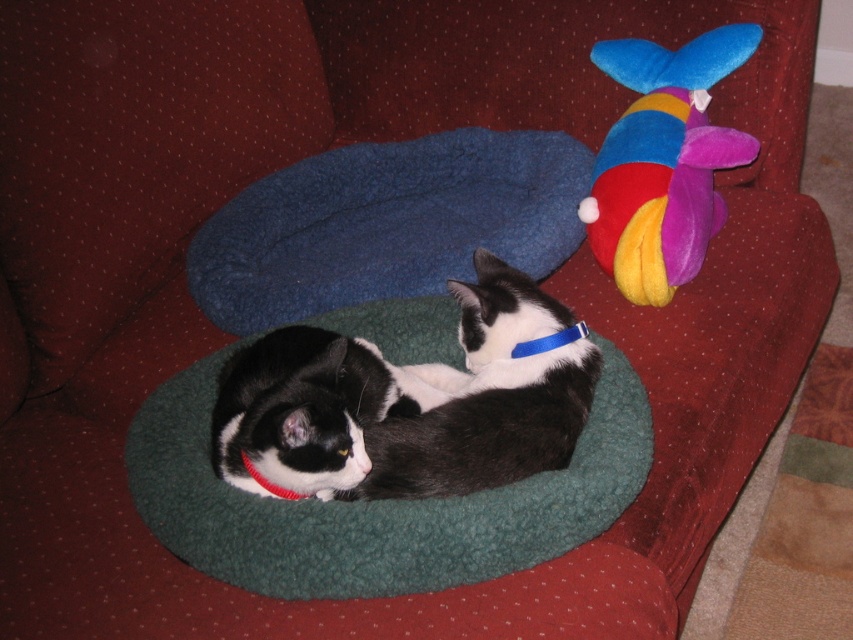
Who is more forward, (706,186) or (540,346)?

Point (540,346) is more forward.

Which is more to the left, velvet plush toy at upper right or blue fabric neckband at center?

blue fabric neckband at center is more to the left.

What do you see at coordinates (663, 161) in the screenshot? This screenshot has width=853, height=640. I see `velvet plush toy at upper right` at bounding box center [663, 161].

Find the location of a particular element. The image size is (853, 640). velvet plush toy at upper right is located at coordinates tap(663, 161).

Does green fleece cat bed at center appear on the left side of blue fabric neckband at center?

Correct, you'll find green fleece cat bed at center to the left of blue fabric neckband at center.

Does green fleece cat bed at center have a lesser height compared to blue fabric neckband at center?

No.

What do you see at coordinates (376, 502) in the screenshot? The image size is (853, 640). I see `green fleece cat bed at center` at bounding box center [376, 502].

The width and height of the screenshot is (853, 640). Find the location of `green fleece cat bed at center`. green fleece cat bed at center is located at coordinates (376, 502).

Can you confirm if green fleece cat bed at center is wider than red fabric neckband at lower left?

Yes, green fleece cat bed at center is wider than red fabric neckband at lower left.

From the picture: Can you confirm if green fleece cat bed at center is taller than red fabric neckband at lower left?

Correct, green fleece cat bed at center is much taller as red fabric neckband at lower left.

Looking at this image, measure the distance between green fleece cat bed at center and camera.

They are 39.35 inches apart.

Identify the location of green fleece cat bed at center. (376, 502).